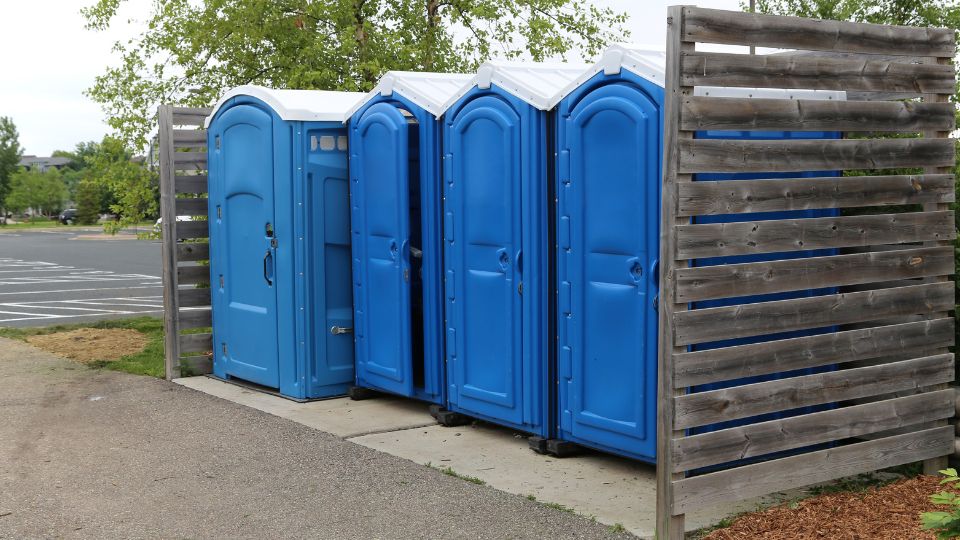
Locate an element on the screen. The height and width of the screenshot is (540, 960). open door is located at coordinates (414, 298).